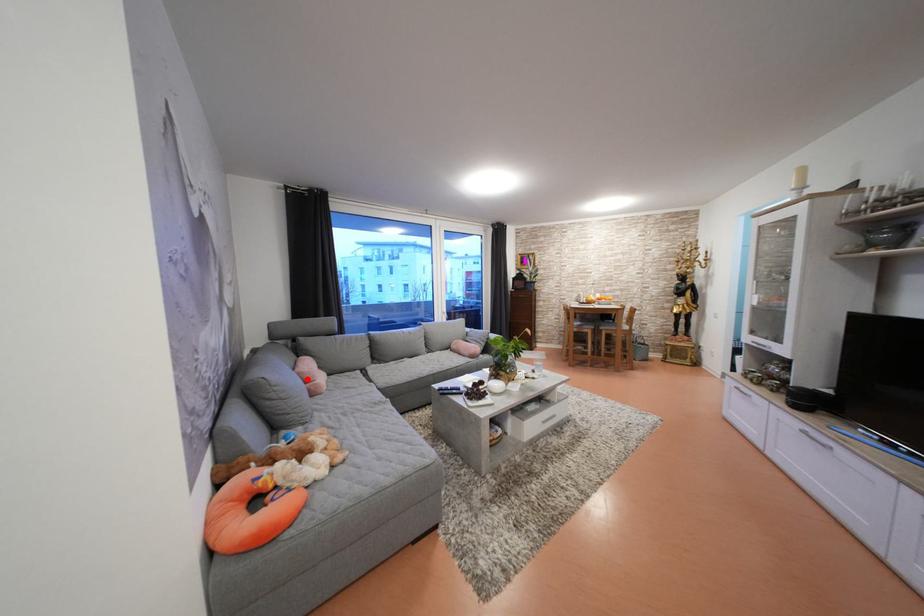
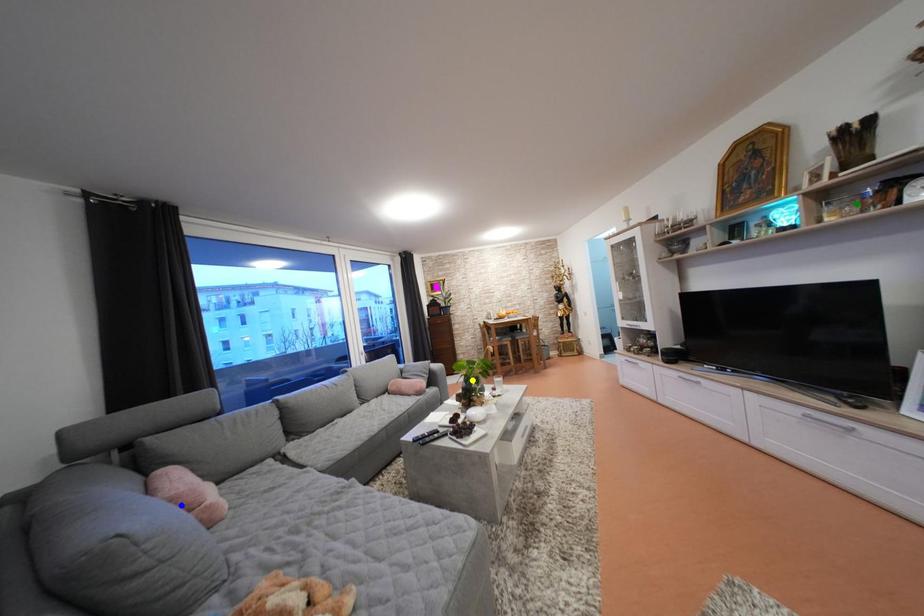
Question: I am providing you with two images of the same scene from different viewpoints. A red point is marked on the first image. You are given multiple points on the second image. Which point in image 2 is actually the same real-world point as the red point in image 1?

Choices:
 (A) blue point
 (B) green point
 (C) yellow point

Answer: (A)